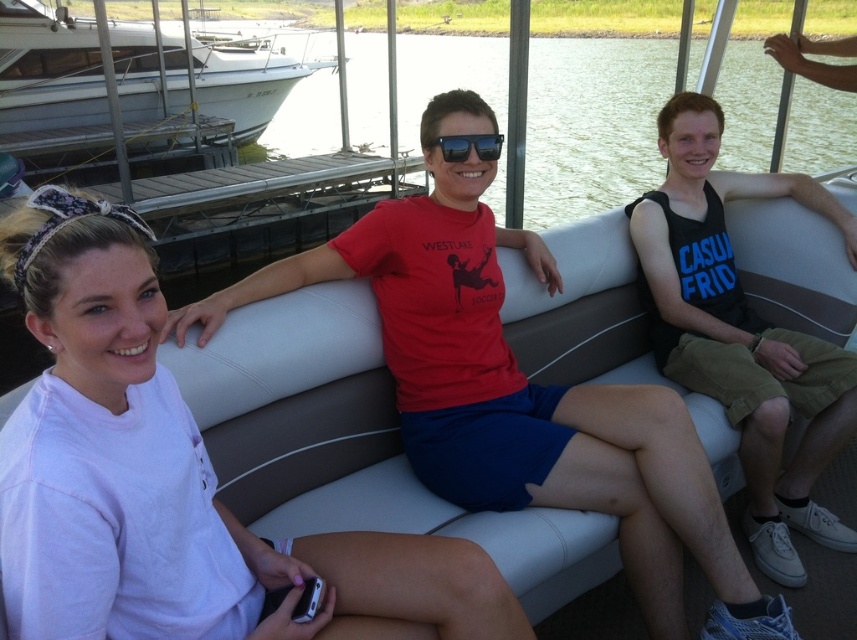
Question: Estimate the real-world distances between objects in this image. Which object is closer to the sunglasses at center?

Choices:
 (A) white glossy boat at left
 (B) white matte shirt at left
 (C) matte red t-shirt at center
 (D) black tank top at right

Answer: (C)

Question: Based on their relative distances, which object is nearer to the white glossy boat at left?

Choices:
 (A) white matte shirt at left
 (B) black tank top at right
 (C) sunglasses at center
 (D) matte red t-shirt at center

Answer: (B)

Question: From the image, what is the correct spatial relationship of white matte shirt at left in relation to white glossy boat at left?

Choices:
 (A) below
 (B) above

Answer: (A)

Question: Is matte red t-shirt at center bigger than white glossy boat at left?

Choices:
 (A) yes
 (B) no

Answer: (B)

Question: Can you confirm if white matte shirt at left is positioned to the right of matte red t-shirt at center?

Choices:
 (A) yes
 (B) no

Answer: (B)

Question: Which object is farther from the camera taking this photo?

Choices:
 (A) sunglasses at center
 (B) white glossy boat at left
 (C) white matte shirt at left
 (D) black tank top at right

Answer: (B)